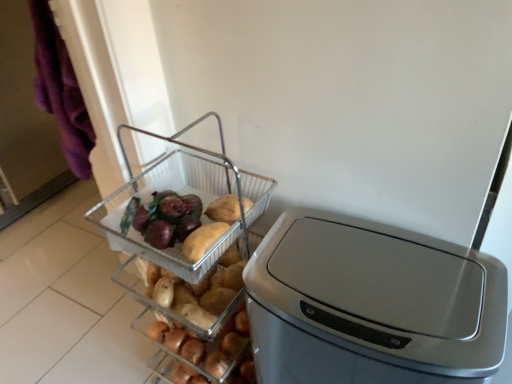
Question: Considering the positions of clear plastic basket at center and satin silver trash can at center in the image, is clear plastic basket at center taller or shorter than satin silver trash can at center?

Choices:
 (A) short
 (B) tall

Answer: (A)

Question: In terms of width, does clear plastic basket at center look wider or thinner when compared to satin silver trash can at center?

Choices:
 (A) wide
 (B) thin

Answer: (B)

Question: Estimate the real-world distances between objects in this image. Which object is closer to the satin silver trash can at center?

Choices:
 (A) clear plastic basket at center
 (B) clear plastic basket at center

Answer: (A)

Question: Which of these objects is positioned closest to the clear plastic basket at center?

Choices:
 (A) satin silver trash can at center
 (B) clear plastic basket at center

Answer: (B)